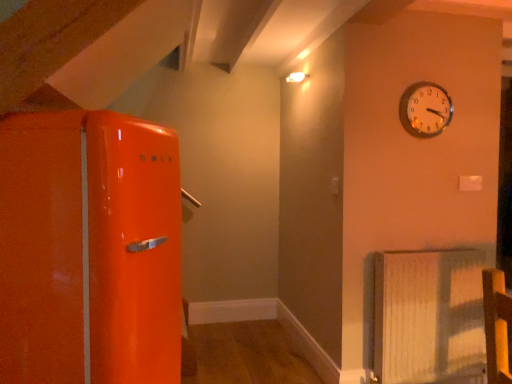
Where is `metallic gold clock at upper right`? metallic gold clock at upper right is located at coordinates (425, 109).

The height and width of the screenshot is (384, 512). Describe the element at coordinates (425, 109) in the screenshot. I see `metallic gold clock at upper right` at that location.

Locate an element on the screen. This screenshot has width=512, height=384. white textured radiator at lower right is located at coordinates (429, 317).

Image resolution: width=512 pixels, height=384 pixels. What do you see at coordinates (429, 317) in the screenshot?
I see `white textured radiator at lower right` at bounding box center [429, 317].

Find the location of `metallic gold clock at upper right`. metallic gold clock at upper right is located at coordinates (425, 109).

Is metallic gold clock at upper right to the left of white textured radiator at lower right from the viewer's perspective?

Correct, you'll find metallic gold clock at upper right to the left of white textured radiator at lower right.

Is metallic gold clock at upper right positioned in front of white textured radiator at lower right?

That is False.

Is point (423, 84) more distant than point (381, 300)?

Yes, it is behind point (381, 300).

From the image's perspective, which one is positioned lower, metallic gold clock at upper right or white textured radiator at lower right?

white textured radiator at lower right is shown below in the image.

From a real-world perspective, is metallic gold clock at upper right above or below white textured radiator at lower right?

metallic gold clock at upper right is above white textured radiator at lower right.

Based on the photo, considering the relative sizes of metallic gold clock at upper right and white textured radiator at lower right in the image provided, is metallic gold clock at upper right thinner than white textured radiator at lower right?

Yes, metallic gold clock at upper right is thinner than white textured radiator at lower right.

Does metallic gold clock at upper right have a greater height compared to white textured radiator at lower right?

In fact, metallic gold clock at upper right may be shorter than white textured radiator at lower right.

Is metallic gold clock at upper right smaller than white textured radiator at lower right?

Yes, metallic gold clock at upper right is smaller than white textured radiator at lower right.

Is metallic gold clock at upper right completely or partially outside of white textured radiator at lower right?

Yes, metallic gold clock at upper right is outside of white textured radiator at lower right.

Is metallic gold clock at upper right next to white textured radiator at lower right and touching it?

metallic gold clock at upper right is not next to white textured radiator at lower right, and they're not touching.

Is white textured radiator at lower right at the back of metallic gold clock at upper right?

No, metallic gold clock at upper right is not facing away from white textured radiator at lower right.

Locate an element on the screen. wall clock that appears above the white textured radiator at lower right (from the image's perspective) is located at coordinates (425, 109).

Which is more to the left, white textured radiator at lower right or metallic gold clock at upper right?

Positioned to the left is metallic gold clock at upper right.

Which object is further away from the camera, white textured radiator at lower right or metallic gold clock at upper right?

metallic gold clock at upper right is further away from the camera.

Considering the positions of point (467, 268) and point (405, 94), is point (467, 268) closer or farther from the camera than point (405, 94)?

Point (467, 268) appears to be closer to the viewer than point (405, 94).

From the image's perspective, is white textured radiator at lower right below metallic gold clock at upper right?

Indeed, from the image's perspective, white textured radiator at lower right is shown beneath metallic gold clock at upper right.

From a real-world perspective, which object stands above the other?

metallic gold clock at upper right, from a real-world perspective.

Between white textured radiator at lower right and metallic gold clock at upper right, which one has smaller width?

Thinner between the two is metallic gold clock at upper right.

Does white textured radiator at lower right have a greater height compared to metallic gold clock at upper right?

Correct, white textured radiator at lower right is much taller as metallic gold clock at upper right.

Does white textured radiator at lower right have a smaller size compared to metallic gold clock at upper right?

No, white textured radiator at lower right is not smaller than metallic gold clock at upper right.

Is metallic gold clock at upper right a part of white textured radiator at lower right?

No.

Is white textured radiator at lower right next to metallic gold clock at upper right?

No, white textured radiator at lower right is not beside metallic gold clock at upper right.

Is metallic gold clock at upper right at the back of white textured radiator at lower right?

white textured radiator at lower right is not turned away from metallic gold clock at upper right.

In order to click on radiator on the right of the metallic gold clock at upper right in this screenshot , I will do `click(429, 317)`.

Identify the location of radiator in front of the metallic gold clock at upper right. (429, 317).

Locate an element on the screen. radiator lying on the right of metallic gold clock at upper right is located at coordinates (429, 317).